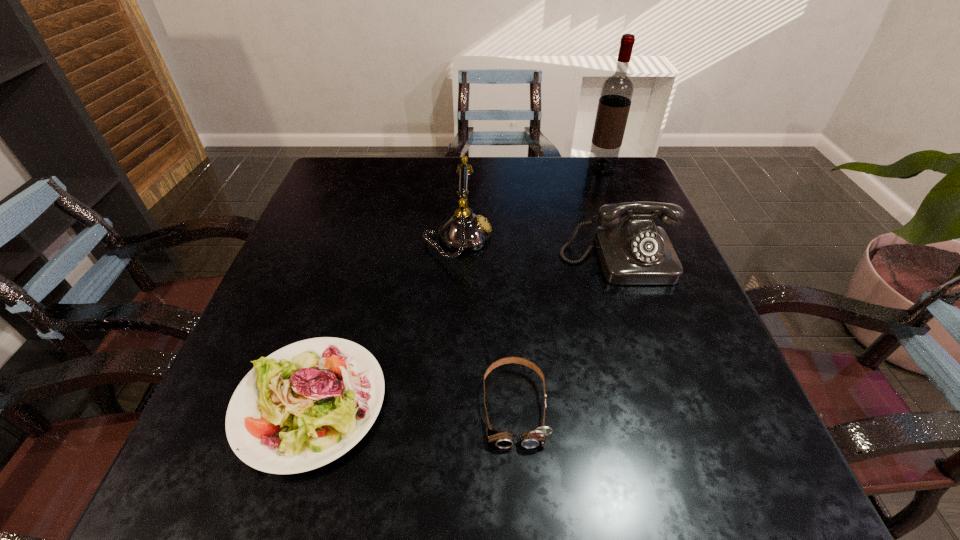
Where is `the tallest object`? The width and height of the screenshot is (960, 540). the tallest object is located at coordinates (617, 90).

You are a GUI agent. You are given a task and a screenshot of the screen. Output one action in this format:
    pyautogui.click(x=<x>, y=<y>)
    Task: Click on the wine bottle
    The height and width of the screenshot is (540, 960).
    Given the screenshot: What is the action you would take?
    pyautogui.click(x=617, y=90)

This screenshot has width=960, height=540. I want to click on the second tallest object, so click(464, 231).

Locate an element on the screen. Image resolution: width=960 pixels, height=540 pixels. the taller telephone is located at coordinates (464, 231).

The image size is (960, 540). I want to click on the right telephone, so click(632, 250).

This screenshot has height=540, width=960. In order to click on the third shortest object in this screenshot , I will do `click(632, 250)`.

Where is `salad plate`? salad plate is located at coordinates (305, 405).

The height and width of the screenshot is (540, 960). Identify the location of goggles. (502, 439).

At what (x,y) coordinates should I click in order to perform the action: click on vacant space located 0.120m on the left of the wine bottle. Please return your answer as a coordinate pair (x, y). The image size is (960, 540). Looking at the image, I should click on (545, 168).

At what (x,y) coordinates should I click in order to perform the action: click on vacant space situated 0.210m on the dial of the left telephone. Please return your answer as a coordinate pair (x, y). Looking at the image, I should click on (581, 238).